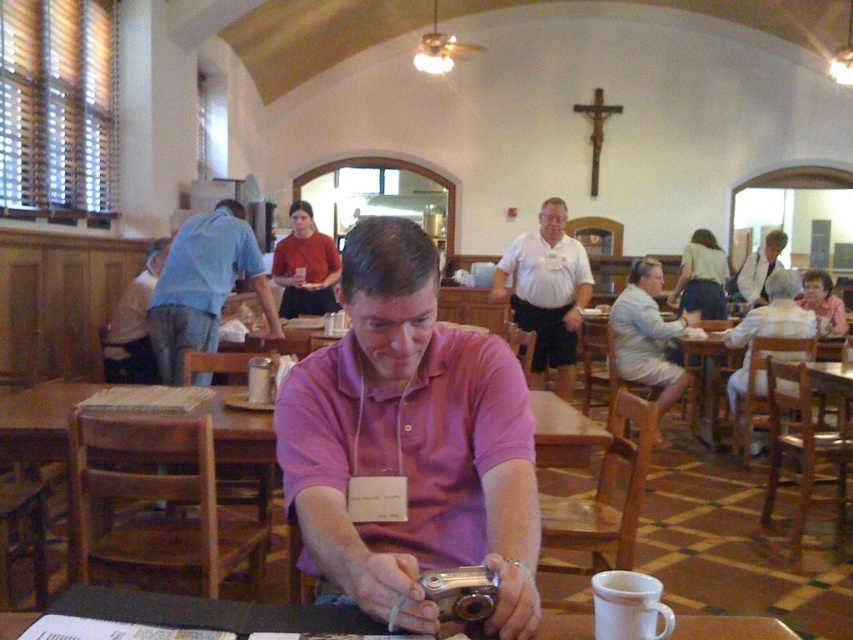
Question: Is white shirt at center smaller than pink fabric shirt at center?

Choices:
 (A) no
 (B) yes

Answer: (A)

Question: In this image, where is wooden table at center located relative to matte red shirt at center?

Choices:
 (A) below
 (B) above

Answer: (A)

Question: Based on their relative distances, which object is nearer to the blue jeans at left?

Choices:
 (A) white shirt at center
 (B) light blue denim shorts at lower right

Answer: (A)

Question: Which point is farther from the camera taking this photo?

Choices:
 (A) 819,294
 (B) 509,268
 (C) 514,454

Answer: (A)

Question: Observing the image, what is the correct spatial positioning of wooden table at center in reference to matte red shirt at center?

Choices:
 (A) right
 (B) left

Answer: (B)

Question: Which point is closer to the camera taking this photo?

Choices:
 (A) (556, 220)
 (B) (706, 312)
 (C) (572, 454)

Answer: (C)